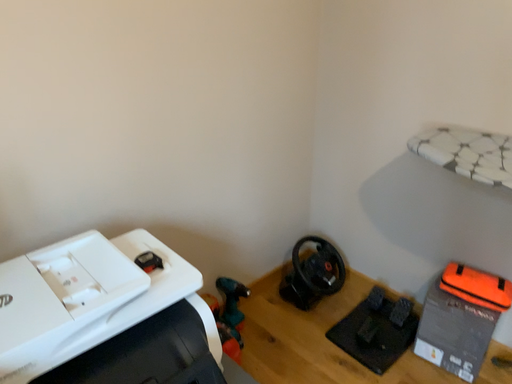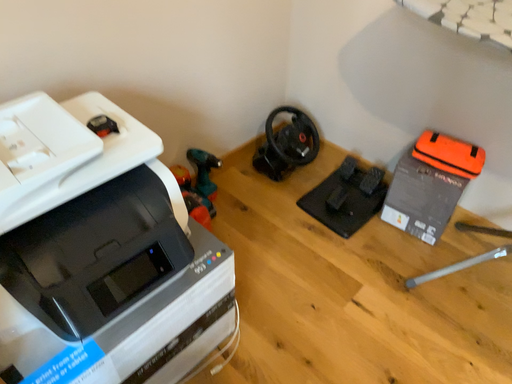
Question: Which way did the camera rotate in the video?

Choices:
 (A) rotated upward
 (B) rotated downward

Answer: (B)